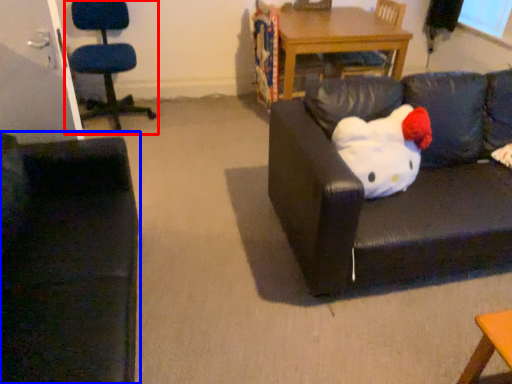
Question: Among these objects, which one is farthest to the camera, chair (highlighted by a red box) or studio couch (highlighted by a blue box)?

Choices:
 (A) chair
 (B) studio couch

Answer: (A)